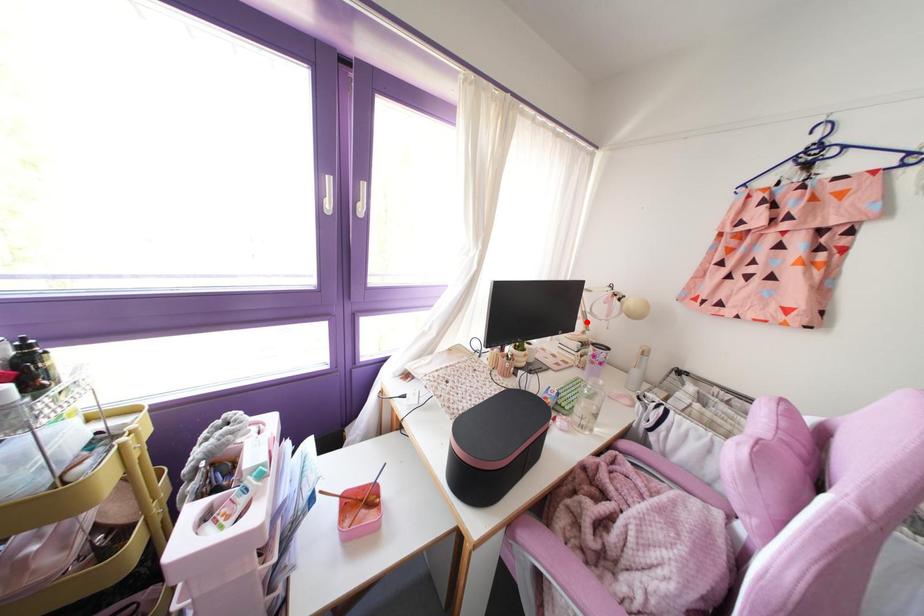
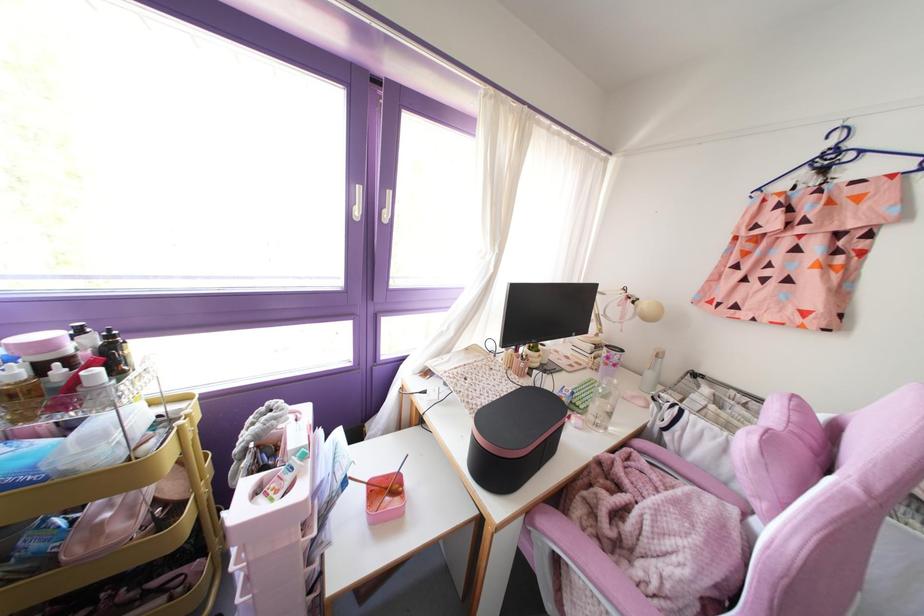
In the second image, find the point that corresponds to the highlighted location in the first image.

(600, 325)